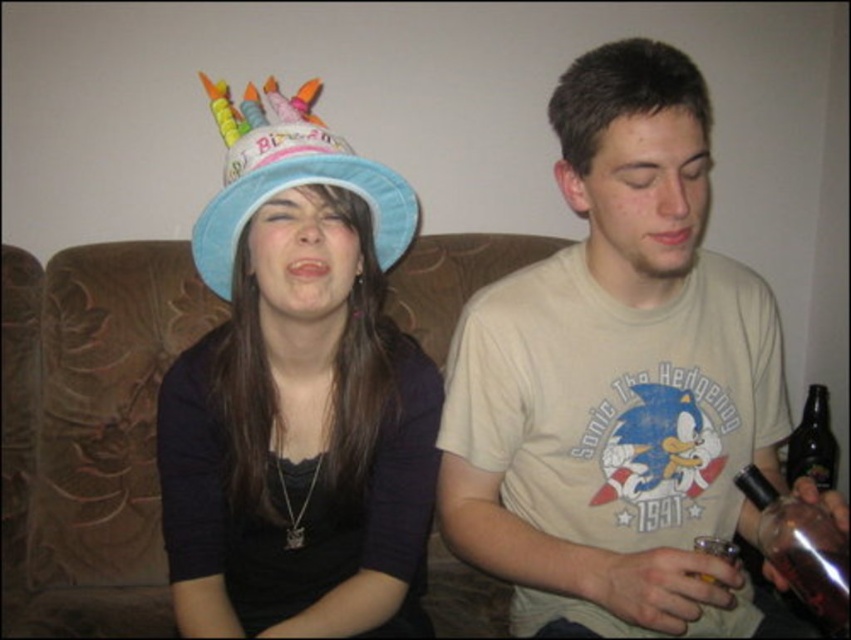
You are a photographer taking a picture of the blue paper hat at upper left and the translucent glass bottle at lower right. Which object should you focus on first if you want to capture both in sharp focus?

The blue paper hat at upper left is located above the translucent glass bottle at lower right, so you should focus on the blue paper hat at upper left first to ensure both are in sharp focus.

You are planning to place a new decorative pillow on the brown fabric couch at center. Considering the size of the blue paper hat at upper left, can you estimate if the couch is wide enough to accommodate the pillow?

The brown fabric couch at center might be wider than blue paper hat at upper left, so it is likely wide enough to place the decorative pillow.

You are designing a living room and need to place a large sculpture that is 1.2 meters wide. The brown fabric couch at center and the blue paper hat at upper left are already in the room. Can the sculpture fit between them without touching either?

The brown fabric couch at center is larger than the blue paper hat at upper left. However, the exact distance between them isn